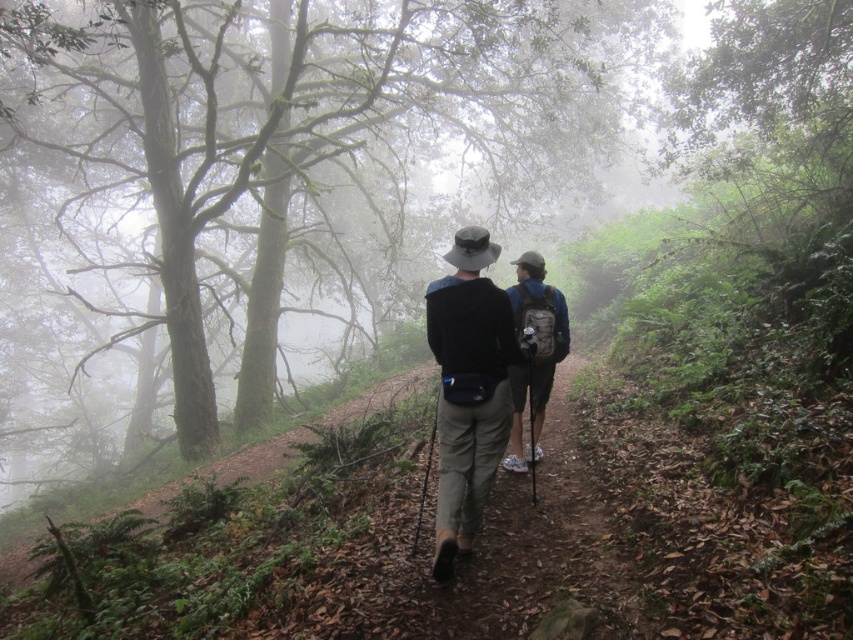
Question: Does dark blue fabric backpack at center appear under blue fabric backpack at center?

Choices:
 (A) yes
 (B) no

Answer: (A)

Question: Which point is farther to the camera?

Choices:
 (A) (508, 458)
 (B) (463, 412)

Answer: (A)

Question: Which point is closer to the camera?

Choices:
 (A) (445, 376)
 (B) (549, 310)

Answer: (A)

Question: Is dark blue fabric backpack at center to the right of blue fabric backpack at center from the viewer's perspective?

Choices:
 (A) no
 (B) yes

Answer: (A)

Question: Which of the following is the farthest from the observer?

Choices:
 (A) (480, 381)
 (B) (537, 308)

Answer: (B)

Question: Can you confirm if dark blue fabric backpack at center is wider than blue fabric backpack at center?

Choices:
 (A) no
 (B) yes

Answer: (B)